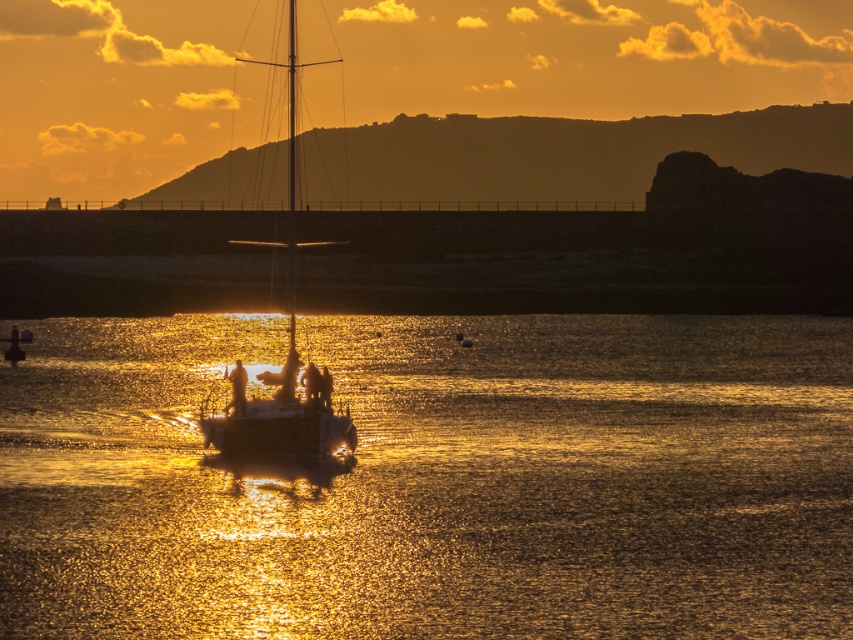
Question: Which of the following is the closest to the observer?

Choices:
 (A) (233, 403)
 (B) (277, 595)
 (C) (294, 296)

Answer: (B)

Question: Is silhouette figure at center below smooth skin person at center?

Choices:
 (A) yes
 (B) no

Answer: (A)

Question: Which object appears farthest from the camera in this image?

Choices:
 (A) smooth skin person at center
 (B) glistening water at center
 (C) shiny metallic sailboat at center

Answer: (A)

Question: Is glistening water at center thinner than silhouette figure at center?

Choices:
 (A) yes
 (B) no

Answer: (B)

Question: Considering the relative positions of shiny metallic sailboat at center and silhouette figure at center in the image provided, where is shiny metallic sailboat at center located with respect to silhouette figure at center?

Choices:
 (A) below
 (B) above

Answer: (B)

Question: Which object is farther from the camera taking this photo?

Choices:
 (A) silhouette figure at center
 (B) smooth skin person at center

Answer: (A)